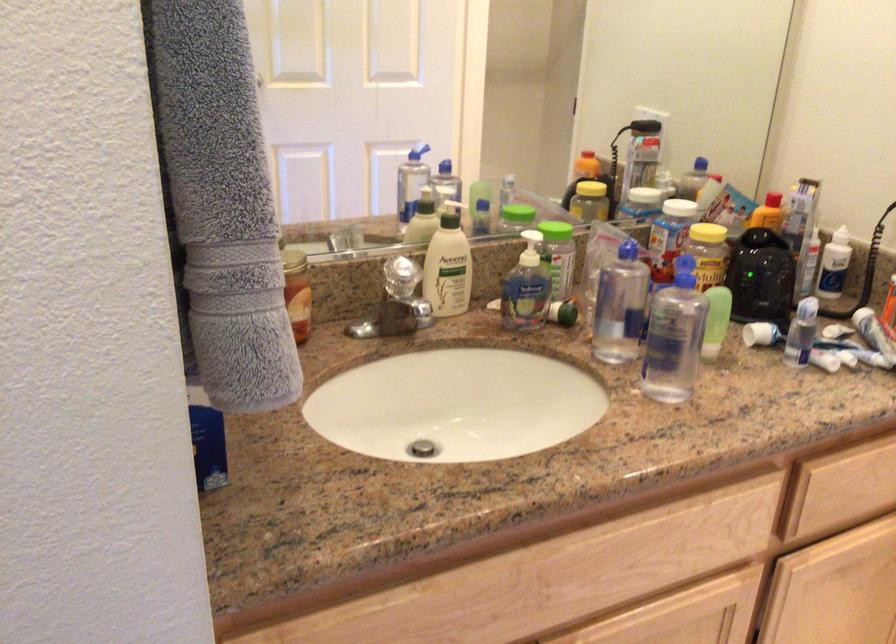
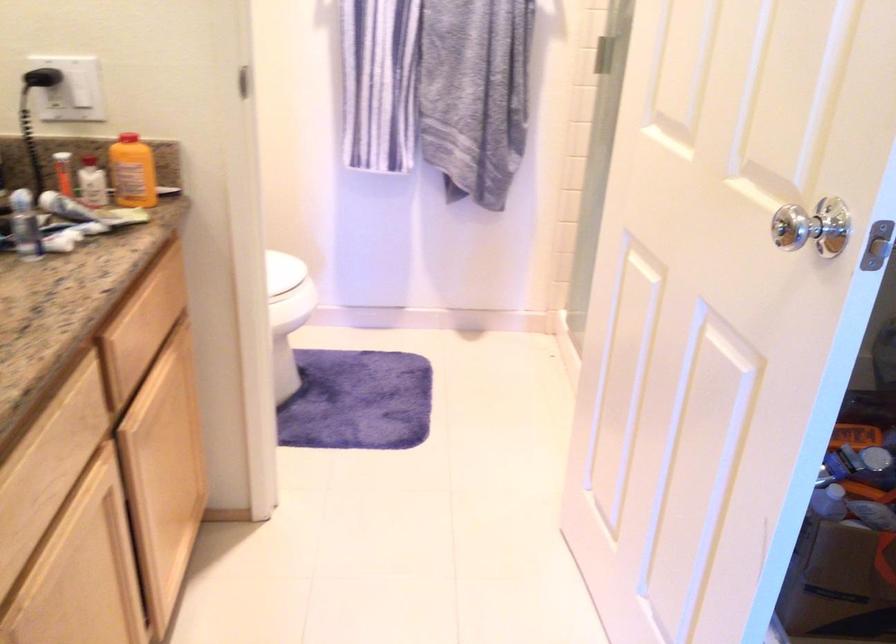
The first image is from the beginning of the video and the second image is from the end. How did the camera likely rotate when shooting the video?

The rotation direction of the camera is right-down.